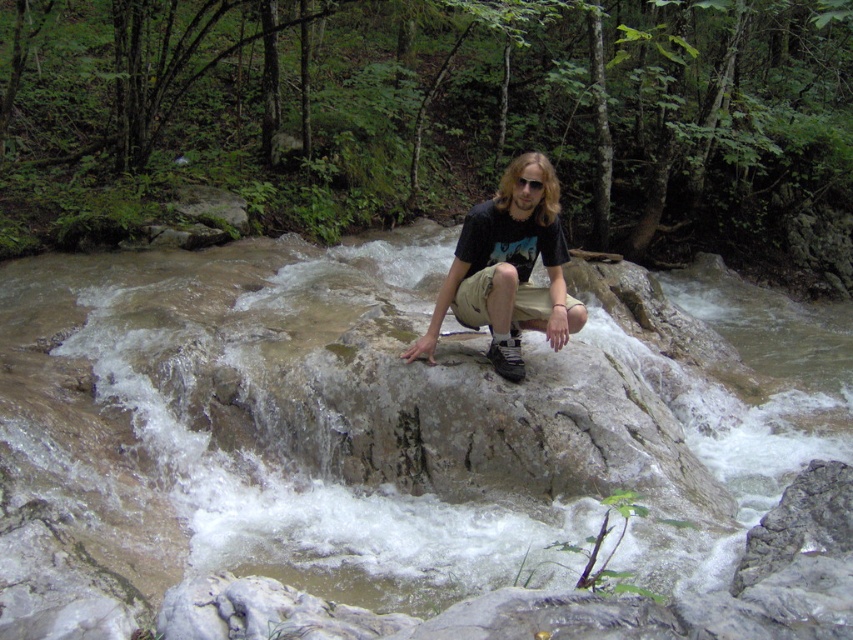
Question: Can you confirm if clear water at rock center is smaller than black matte t-shirt at center?

Choices:
 (A) yes
 (B) no

Answer: (B)

Question: Which of the following is the closest to the observer?

Choices:
 (A) black matte t-shirt at center
 (B) clear water at rock center

Answer: (B)

Question: Is clear water at rock center wider than black matte t-shirt at center?

Choices:
 (A) yes
 (B) no

Answer: (A)

Question: Is clear water at rock center bigger than black matte t-shirt at center?

Choices:
 (A) yes
 (B) no

Answer: (A)